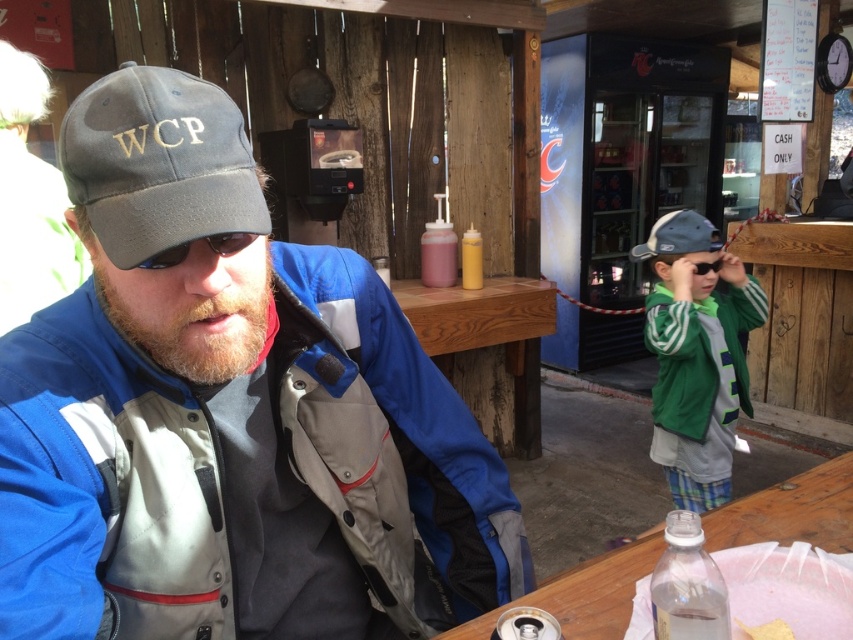
Question: Among these points, which one is nearest to the camera?

Choices:
 (A) (622, 620)
 (B) (676, 445)
 (C) (368, 410)
 (D) (247, 184)

Answer: (D)

Question: Can you confirm if wooden table at lower right is positioned to the left of clear plastic bottle at lower right?

Choices:
 (A) no
 (B) yes

Answer: (A)

Question: Which point is farther from the camera taking this photo?

Choices:
 (A) (100, 563)
 (B) (717, 268)
 (C) (245, 188)
 (D) (712, 627)

Answer: (B)

Question: Is matte gray cap at center thinner than green fleece jacket at right?

Choices:
 (A) yes
 (B) no

Answer: (B)

Question: Where is matte gray cap at center located in relation to green fleece jacket at right in the image?

Choices:
 (A) left
 (B) right

Answer: (A)

Question: Which of the following is the farthest from the observer?

Choices:
 (A) (663, 244)
 (B) (230, 246)

Answer: (A)